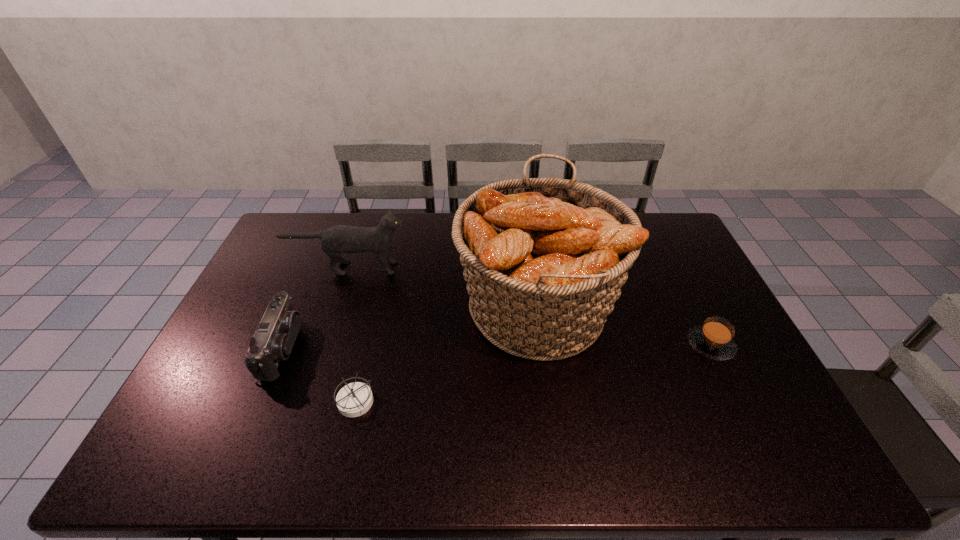
The width and height of the screenshot is (960, 540). Find the location of `free space that satisfies the following two spatial constraints: 1. on the front-facing side of the cat; 2. on the left side of the cappuccino`. free space that satisfies the following two spatial constraints: 1. on the front-facing side of the cat; 2. on the left side of the cappuccino is located at coordinates pos(322,345).

The height and width of the screenshot is (540, 960). I want to click on vacant point that satisfies the following two spatial constraints: 1. on the front-facing side of the cat; 2. on the left side of the basket, so click(x=334, y=308).

In order to click on blank area in the image that satisfies the following two spatial constraints: 1. on the front-facing side of the second tallest object; 2. on the right side of the rightmost object in this screenshot , I will do `click(322, 345)`.